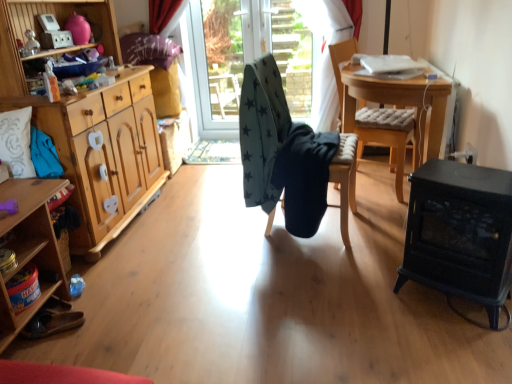
The width and height of the screenshot is (512, 384). Find the location of `vacant point to the right of brown leather shoes at lower left`. vacant point to the right of brown leather shoes at lower left is located at coordinates (114, 317).